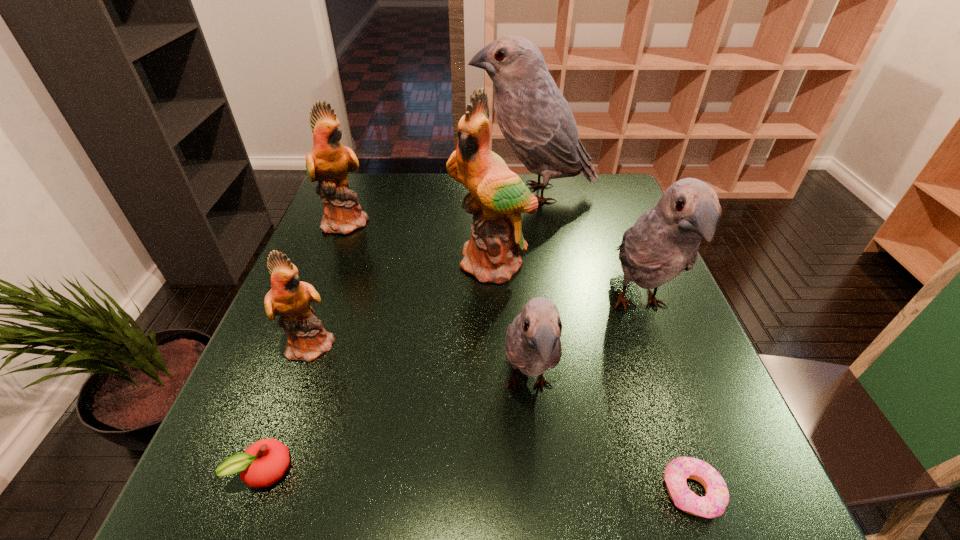
Find the location of a particular element. This screenshot has width=960, height=540. the biggest gray parrot is located at coordinates (536, 120).

You are a GUI agent. You are given a task and a screenshot of the screen. Output one action in this format:
    pyautogui.click(x=<x>, y=<y>)
    Task: Click on the rightmost green parrot
    This screenshot has width=960, height=540.
    Given the screenshot: What is the action you would take?
    pyautogui.click(x=497, y=196)

Where is `the biggest green parrot`? the biggest green parrot is located at coordinates (497, 196).

Locate an element on the screen. The height and width of the screenshot is (540, 960). the second biggest green parrot is located at coordinates (328, 162).

You are a GUI agent. You are given a task and a screenshot of the screen. Output one action in this format:
    pyautogui.click(x=<x>, y=<y>)
    Task: Click on the second biggest gray parrot
    The image size is (960, 540).
    Given the screenshot: What is the action you would take?
    pyautogui.click(x=664, y=241)

Where is `the nearest green parrot`? This screenshot has height=540, width=960. the nearest green parrot is located at coordinates (307, 339).

Where is `the smallest gray parrot`? This screenshot has height=540, width=960. the smallest gray parrot is located at coordinates (532, 344).

Identify the location of red apple. (263, 463).

The width and height of the screenshot is (960, 540). Identify the location of the second shortest object. (263, 463).

This screenshot has height=540, width=960. Identify the location of the shortest object. (713, 504).